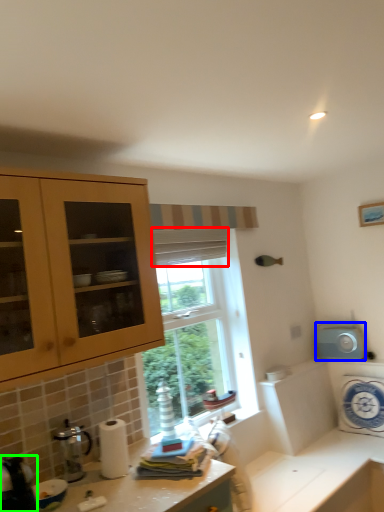
Question: Estimate the real-world distances between objects in this image. Which object is farther from curtain (highlighted by a red box), appliance (highlighted by a blue box) or appliance (highlighted by a green box)?

Choices:
 (A) appliance
 (B) appliance

Answer: (B)